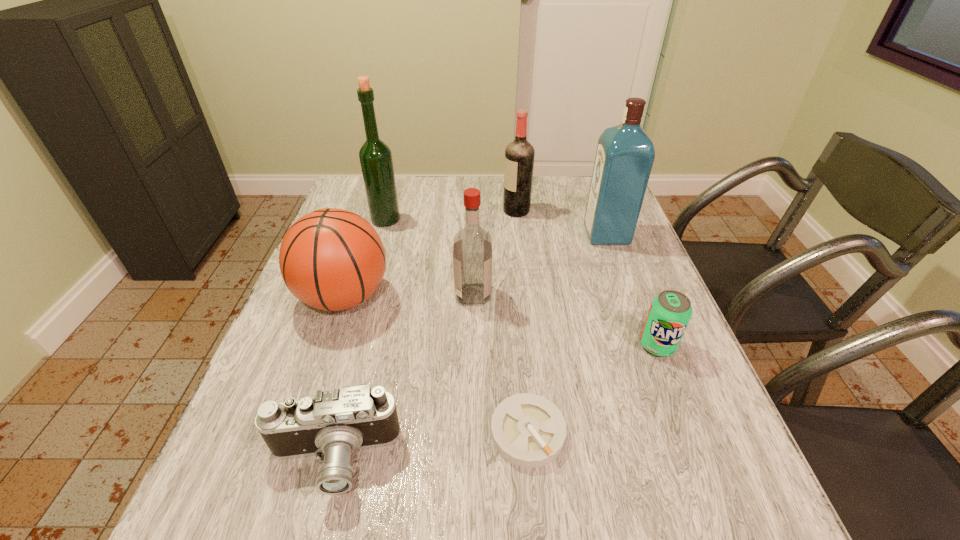
Where is `the leftmost liquor`? The height and width of the screenshot is (540, 960). the leftmost liquor is located at coordinates (375, 156).

I want to click on the rightmost liquor, so click(x=625, y=154).

Locate an element on the screen. The image size is (960, 540). the third liquor from left to right is located at coordinates (519, 155).

What are the coordinates of `the nearest liquor` in the screenshot? It's located at tap(472, 247).

Locate an element on the screen. basketball is located at coordinates (331, 259).

At what (x,y) coordinates should I click in order to perform the action: click on pop soda. Please return your answer as a coordinate pair (x, y). This screenshot has width=960, height=540. Looking at the image, I should click on (670, 312).

Image resolution: width=960 pixels, height=540 pixels. What are the coordinates of `camera` in the screenshot? It's located at (334, 423).

Image resolution: width=960 pixels, height=540 pixels. What are the coordinates of `ashtray` in the screenshot? It's located at (528, 430).

Where is `vacant space located on the left of the leftmost liquor`? The image size is (960, 540). vacant space located on the left of the leftmost liquor is located at coordinates (339, 220).

Find the location of `vacant region located 0.110m on the flat label side of the rightmost liquor`. vacant region located 0.110m on the flat label side of the rightmost liquor is located at coordinates (548, 235).